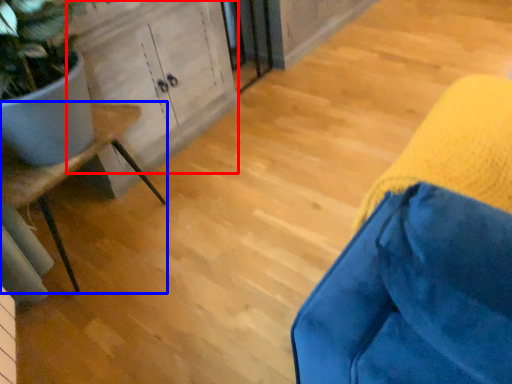
Question: Which of the following is the farthest to the observer, cabinetry (highlighted by a red box) or furniture (highlighted by a blue box)?

Choices:
 (A) cabinetry
 (B) furniture

Answer: (A)